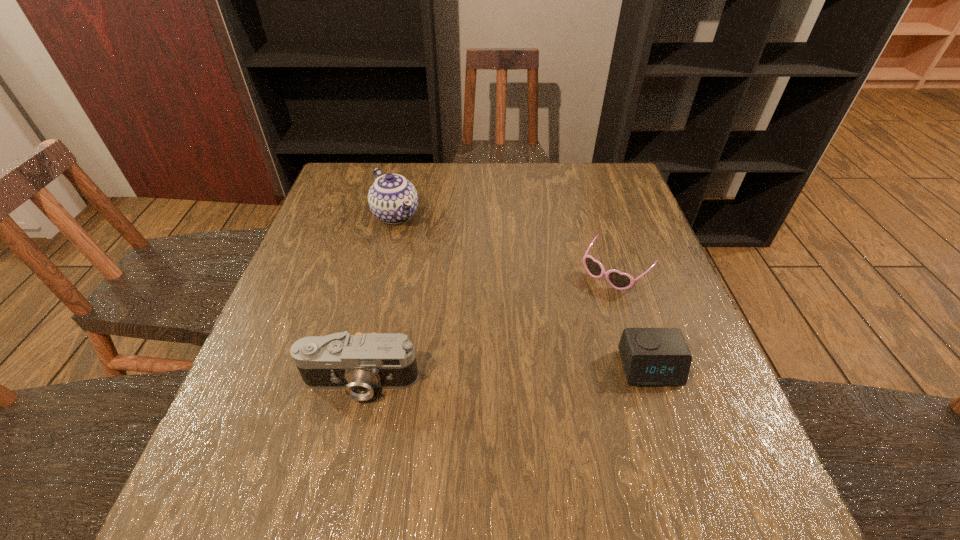
You are a GUI agent. You are given a task and a screenshot of the screen. Output one action in this format:
    pyautogui.click(x=<x>, y=<y>)
    Task: Click on the camera
    This screenshot has height=540, width=960.
    Given the screenshot: What is the action you would take?
    pyautogui.click(x=359, y=363)

What are the coordinates of `alarm clock` in the screenshot? It's located at (652, 357).

The image size is (960, 540). In order to click on the shortest object in this screenshot , I will do `click(621, 281)`.

Identify the location of sunglasses. This screenshot has width=960, height=540. (621, 281).

Find the location of a particular element. Image resolution: width=960 pixels, height=540 pixels. the tallest object is located at coordinates (393, 199).

Where is `chinaware`? The height and width of the screenshot is (540, 960). chinaware is located at coordinates (393, 199).

Where is `free spot located on the lens of the second tallest object`? The width and height of the screenshot is (960, 540). free spot located on the lens of the second tallest object is located at coordinates (347, 441).

This screenshot has width=960, height=540. I want to click on free space located on the front-facing side of the alarm clock, so click(666, 416).

Locate an element on the screen. vacant position located 0.390m on the front-facing side of the sunglasses is located at coordinates (492, 403).

Where is `free region located on the front-facing side of the sunglasses`? This screenshot has width=960, height=540. free region located on the front-facing side of the sunglasses is located at coordinates (536, 356).